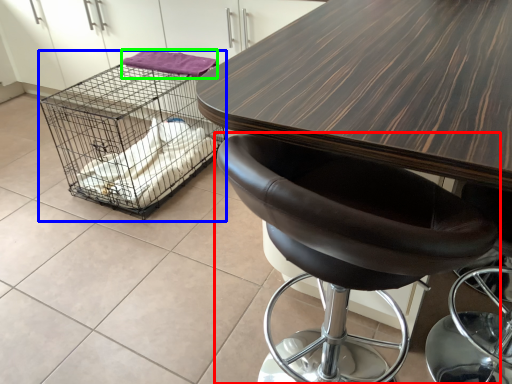
Question: Which object is positioned closest to chair (highlighted by a red box)? Select from bird cage (highlighted by a blue box) and material (highlighted by a green box).

Choices:
 (A) bird cage
 (B) material

Answer: (B)